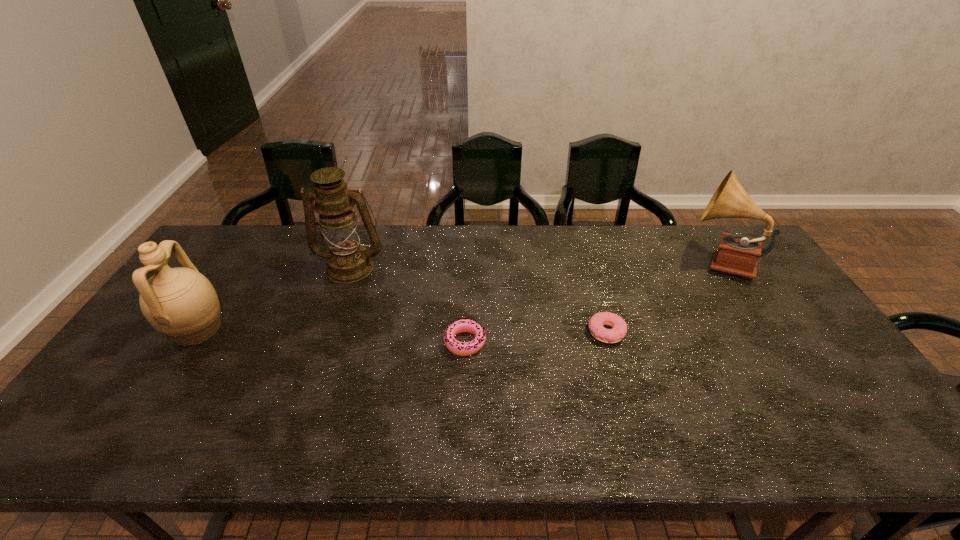
This screenshot has height=540, width=960. I want to click on oil lamp, so click(348, 261).

In order to click on the rightmost object in this screenshot , I will do `click(737, 254)`.

This screenshot has height=540, width=960. Find the location of `the leftmost object`. the leftmost object is located at coordinates (180, 303).

You are a GUI agent. You are given a task and a screenshot of the screen. Output one action in this format:
    pyautogui.click(x=<x>, y=<y>)
    Task: Click on the second object from right to left
    
    Given the screenshot: What is the action you would take?
    pyautogui.click(x=619, y=327)

Find the location of a particular element. This screenshot has height=540, width=960. the left doughnut is located at coordinates (458, 348).

The height and width of the screenshot is (540, 960). Identify the location of blank area located on the right of the oil lamp. (474, 267).

The width and height of the screenshot is (960, 540). In order to click on vacant region located 0.290m on the horn of the rightmost object in this screenshot , I will do `click(598, 261)`.

At what (x,y) coordinates should I click in order to perform the action: click on vacant region located on the horn of the rightmost object. Please return your answer as a coordinate pair (x, y). The width and height of the screenshot is (960, 540). Looking at the image, I should click on (615, 261).

Locate an element on the screen. The height and width of the screenshot is (540, 960). free point located 0.180m on the horn of the rightmost object is located at coordinates (631, 261).

Where is `free space located on the right of the pitcher`? The image size is (960, 540). free space located on the right of the pitcher is located at coordinates (288, 330).